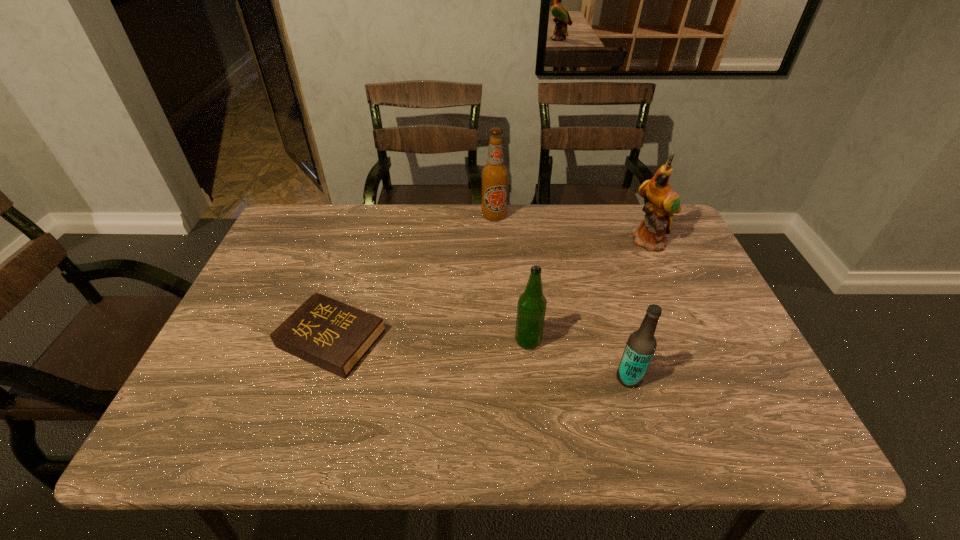
You are a GUI agent. You are given a task and a screenshot of the screen. Output one action in this format:
    pyautogui.click(x=<x>, y=<y>)
    Task: Click on the fourth nearest object
    
    Given the screenshot: What is the action you would take?
    pyautogui.click(x=663, y=202)

Image resolution: width=960 pixels, height=540 pixels. I want to click on the rightmost object, so click(663, 202).

Where is `the tallest beer bottle`? This screenshot has height=540, width=960. the tallest beer bottle is located at coordinates (494, 174).

Locate an element on the screen. Image resolution: width=960 pixels, height=540 pixels. the farthest beer bottle is located at coordinates (494, 174).

Locate an element on the screen. The width and height of the screenshot is (960, 540). the second farthest beer bottle is located at coordinates (531, 309).

In order to click on the rightmost beer bottle in this screenshot , I will do `click(641, 345)`.

Locate an element on the screen. the nearest beer bottle is located at coordinates (641, 345).

I want to click on the shortest object, so click(x=334, y=336).

I want to click on hardback book, so click(334, 336).

Locate an element on the screen. The height and width of the screenshot is (540, 960). vacant space situated on the front-facing side of the parrot is located at coordinates (676, 296).